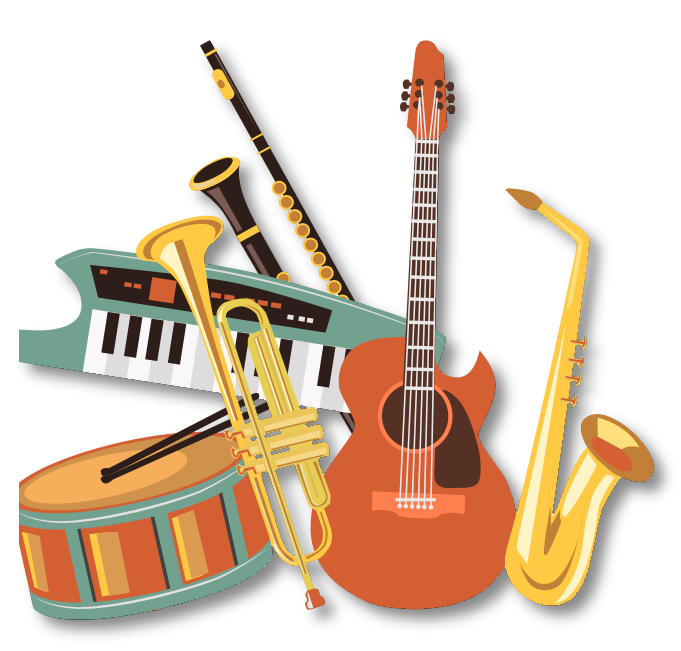
Where is `keyboard`? The image size is (681, 651). keyboard is located at coordinates (116, 364).